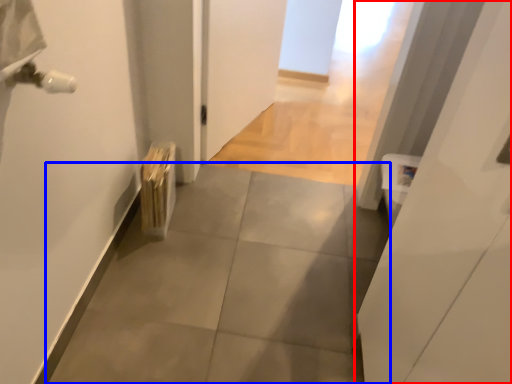
Question: Among these objects, which one is nearest to the camera, door (highlighted by a red box) or concrete (highlighted by a blue box)?

Choices:
 (A) door
 (B) concrete

Answer: (A)